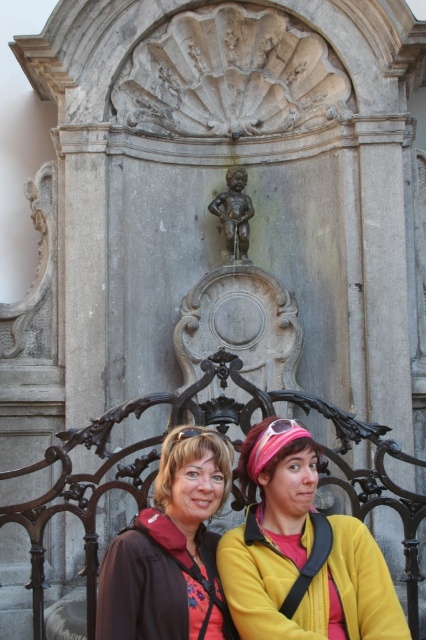
Question: Which object appears farthest from the camera in this image?

Choices:
 (A) matte brown jacket at lower center
 (B) bronze statue at center
 (C) matte yellow jacket at center

Answer: (B)

Question: Based on their relative distances, which object is farther from the matte yellow jacket at center?

Choices:
 (A) matte brown jacket at lower center
 (B) bronze statue at center

Answer: (B)

Question: Which point is closer to the camera?

Choices:
 (A) matte brown jacket at lower center
 (B) bronze statue at center

Answer: (A)

Question: Can you confirm if matte brown jacket at lower center is positioned above bronze statue at center?

Choices:
 (A) yes
 (B) no

Answer: (B)

Question: In this image, where is matte brown jacket at lower center located relative to bronze statue at center?

Choices:
 (A) left
 (B) right

Answer: (A)

Question: Can you confirm if matte yellow jacket at center is positioned below bronze statue at center?

Choices:
 (A) no
 (B) yes

Answer: (B)